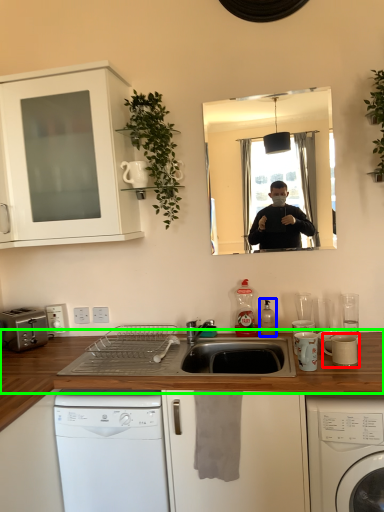
Question: Which object is the farthest from appliance (highlighted by a red box)? Choose among these: bottle (highlighted by a blue box) or countertop (highlighted by a green box).

Choices:
 (A) bottle
 (B) countertop

Answer: (B)